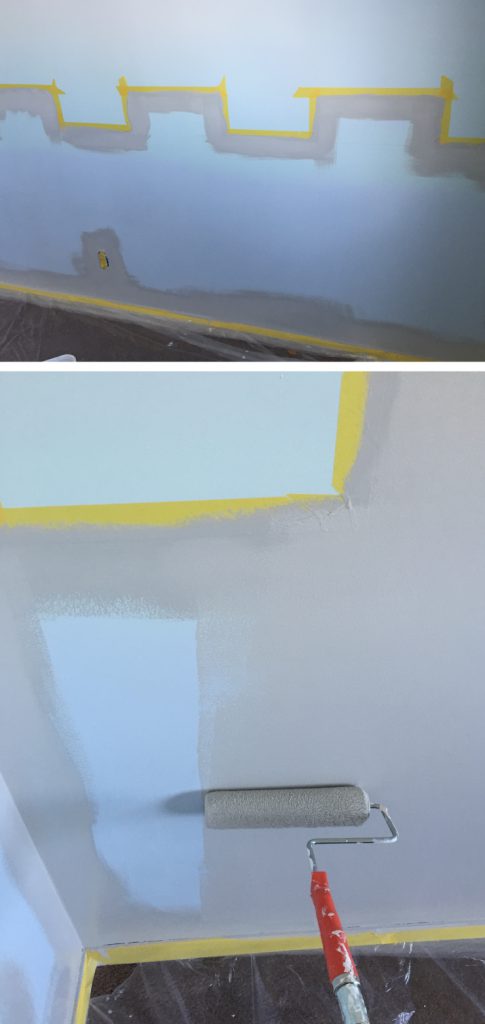
Where is `electrical outlet`? The image size is (485, 1024). electrical outlet is located at coordinates (104, 259).